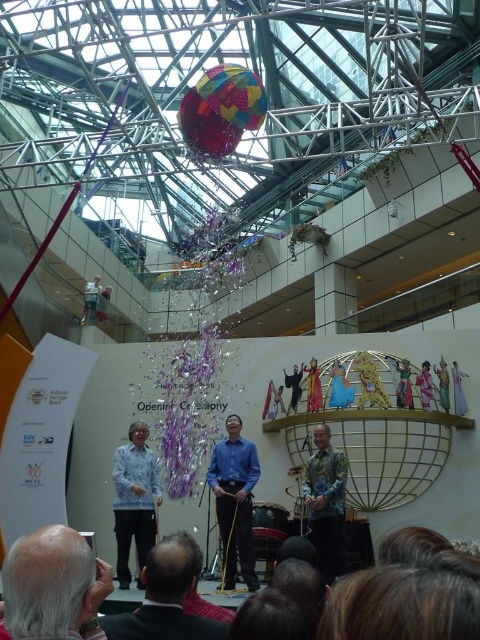
What is located at the coordinate point [52,586] in the image?

At point [52,586] lies gray hair at lower left.

You are a photographer positioned at the camera. You need to focus on both the point at (x=157, y=593) and the point at (x=233, y=413). Which point will require you to adjust your focus to be closer to the camera?

Point at (x=157, y=593) is closer to the camera than point at (x=233, y=413), so you will need to focus on the point at (x=157, y=593) by adjusting your focus closer to the camera.